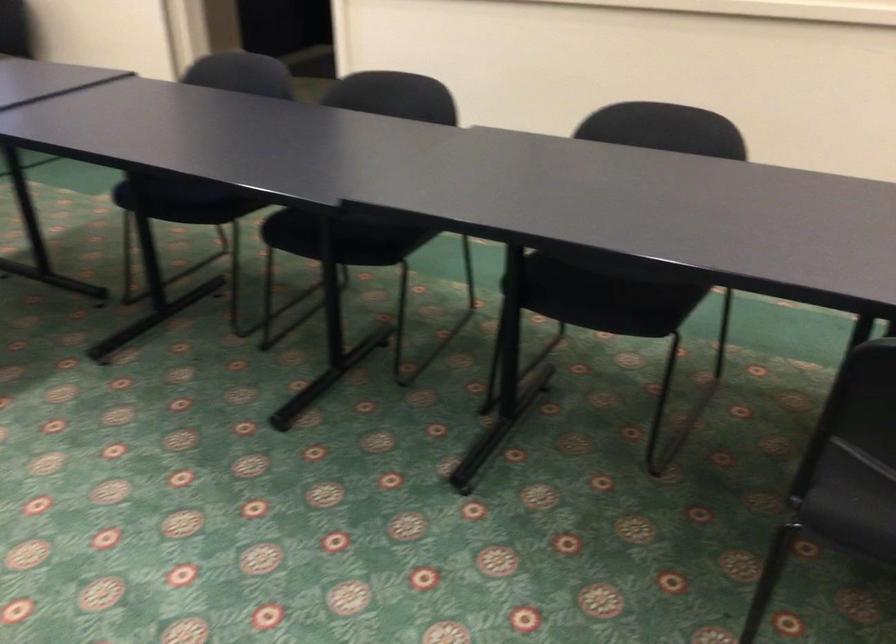
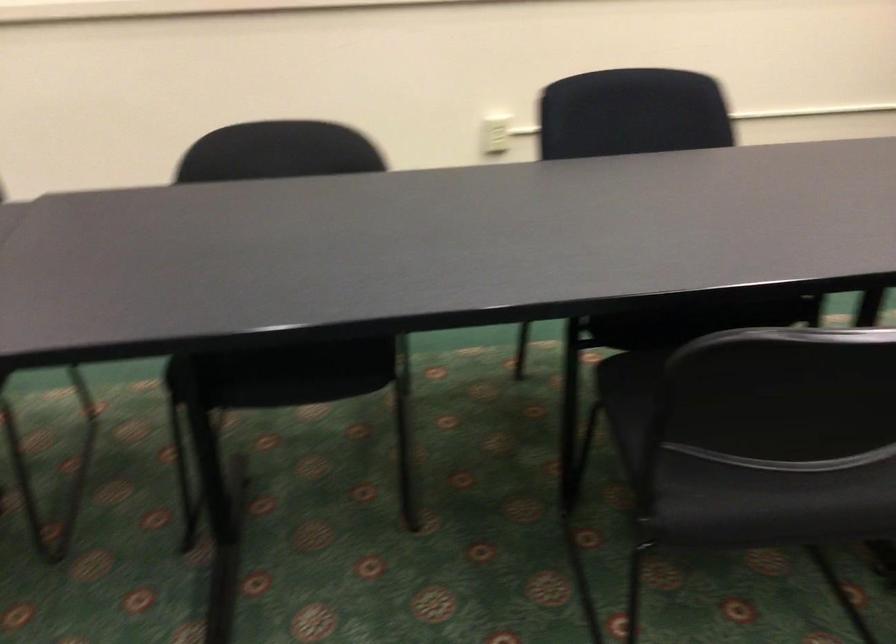
Question: The camera is either moving clockwise (left) or counter-clockwise (right) around the object. The first image is from the beginning of the video and the second image is from the end. Is the camera moving left or right when shooting the video?

Choices:
 (A) Left
 (B) Right

Answer: (A)